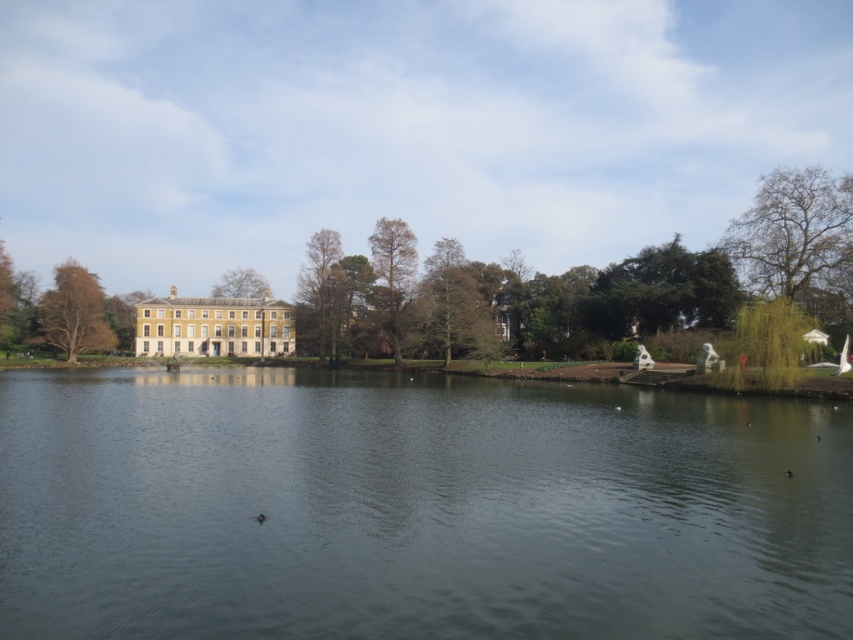
Question: Does green matte tree at center come behind brown leafy tree at left?

Choices:
 (A) no
 (B) yes

Answer: (B)

Question: Estimate the real-world distances between objects in this image. Which object is closer to the beige stone palace at center?

Choices:
 (A) green matte tree at center
 (B) brown textured tree at center
 (C) brown leafy tree at left
 (D) dark gray water at center

Answer: (C)

Question: Is brown leafy tree at left further to the viewer compared to brown textured tree at upper center?

Choices:
 (A) yes
 (B) no

Answer: (B)

Question: Which of the following is the farthest from the observer?

Choices:
 (A) (415, 529)
 (B) (315, 328)

Answer: (B)

Question: Based on their relative distances, which object is farther from the dark gray water at center?

Choices:
 (A) brown textured tree at center
 (B) beige stone palace at center
 (C) brown leafy tree at left
 (D) brown textured tree at upper center

Answer: (D)

Question: Can you confirm if brown leafy tree at left is bigger than brown textured tree at upper center?

Choices:
 (A) yes
 (B) no

Answer: (A)